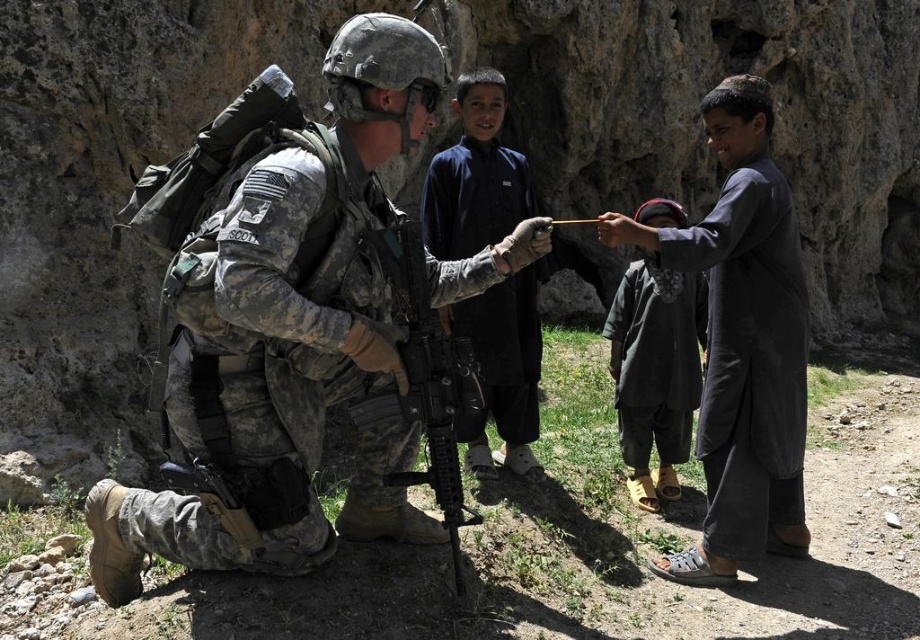
Question: Estimate the real-world distances between objects in this image. Which object is closer to the matte black rifle at center?

Choices:
 (A) dark gray fabric cap at right
 (B) camouflage uniform at center

Answer: (B)

Question: Which point is farther to the camera?

Choices:
 (A) matte black rifle at center
 (B) camouflage uniform at center
 (C) dark blue cotton shirt at center
 (D) dark gray fabric cap at right

Answer: (D)

Question: In this image, where is dark blue cotton shirt at center located relative to matte black rifle at center?

Choices:
 (A) below
 (B) above

Answer: (B)

Question: Is dark gray fabric cap at right positioned behind matte black rifle at center?

Choices:
 (A) yes
 (B) no

Answer: (A)

Question: Which is farther from the matte black rifle at center?

Choices:
 (A) dark gray fabric at right
 (B) dark gray fabric cap at right
 (C) dark blue cotton shirt at center

Answer: (B)

Question: Is camouflage uniform at center above dark gray fabric cap at right?

Choices:
 (A) yes
 (B) no

Answer: (B)